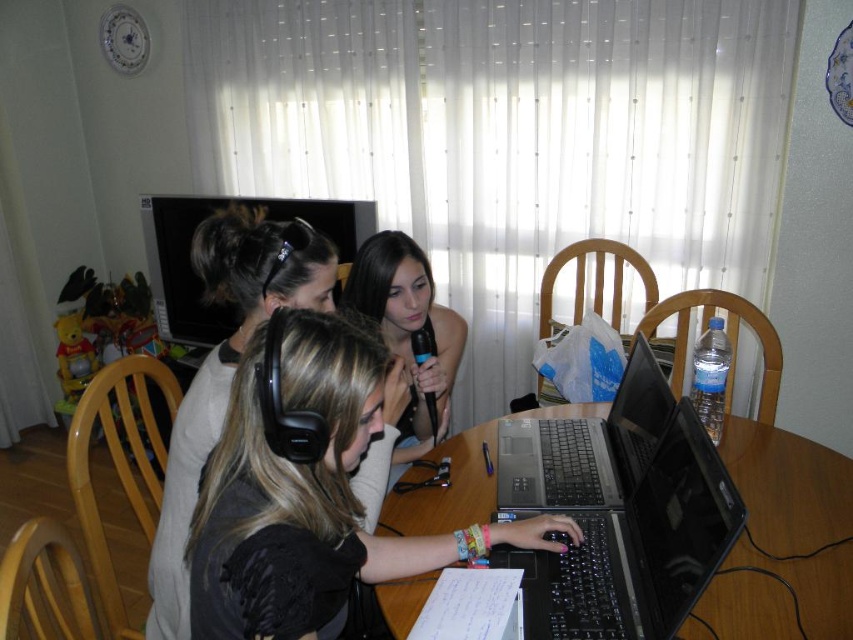
You are organizing a small tech fair and need to place the black matte headphones at center and the black plastic laptop at center on a display table. Given their sizes, which item should you place first to ensure both fit properly?

The black plastic laptop at center is smaller than the black matte headphones at center, so you should place the black matte headphones at center first to ensure both items fit properly on the display table.

You are organizing a small event and need to place a 18cm wide decorative plate on the table. Given the current arrangement with the black matte headphones at center and the black plastic laptop at center, can you determine if there is enough space between them to place the plate?

The black matte headphones at center might be wider than the black plastic laptop at center, so there may not be enough space between them to fit an 18cm wide decorative plate. Check the actual dimensions before placing it.